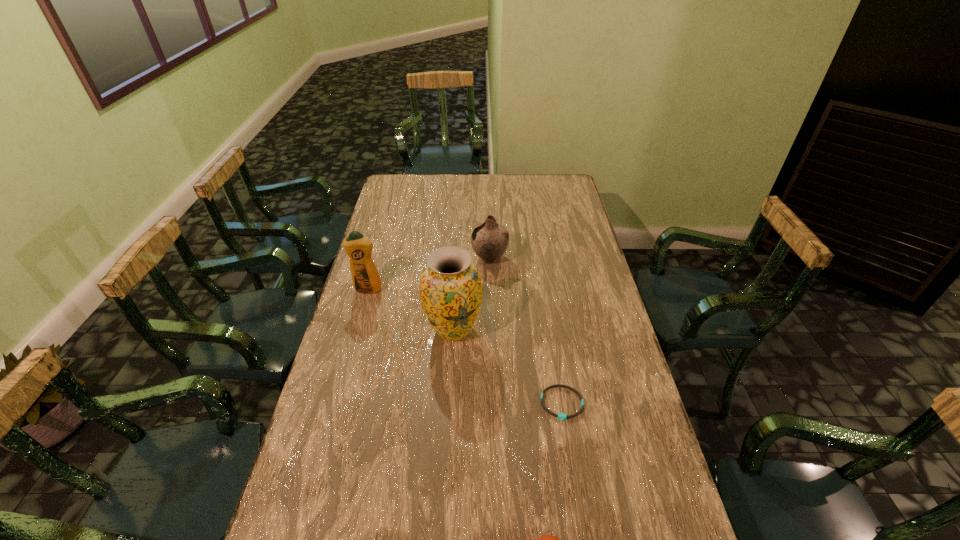
You are a GUI agent. You are given a task and a screenshot of the screen. Output one action in this format:
    pyautogui.click(x=<x>, y=<y>)
    Task: Click on the free spot between the third farthest object and the shortest object
    Image resolution: width=960 pixels, height=540 pixels.
    Given the screenshot: What is the action you would take?
    pyautogui.click(x=508, y=367)

Image resolution: width=960 pixels, height=540 pixels. Identify the location of free space that is in between the third nearest object and the shortest object. (508, 367).

Identify which object is located as the nearest to the third nearest object. Please provide its 2D coordinates. Your answer should be formatted as a tuple, i.e. [(x, y)], where the tuple contains the x and y coordinates of a point satisfying the conditions above.

[(365, 276)]

Image resolution: width=960 pixels, height=540 pixels. What are the coordinates of `the closest object relative to the pottery` in the screenshot? It's located at (450, 288).

This screenshot has width=960, height=540. Find the location of `vacant space that satisfies the following two spatial constraints: 1. on the label of the leftmost object; 2. on the left side of the vase`. vacant space that satisfies the following two spatial constraints: 1. on the label of the leftmost object; 2. on the left side of the vase is located at coordinates (356, 330).